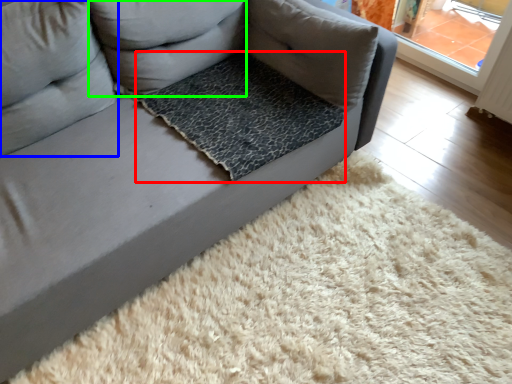
Question: Which object is positioned farthest from dog bed (highlighted by a red box)? Select from pillow (highlighted by a blue box) and pillow (highlighted by a green box).

Choices:
 (A) pillow
 (B) pillow

Answer: (A)